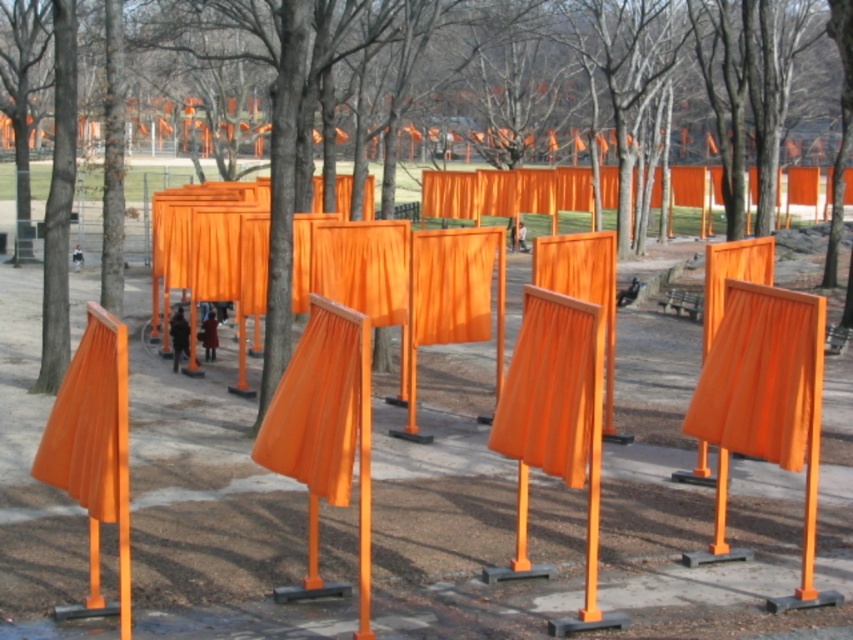
Question: Which point is closer to the camera?

Choices:
 (A) matte orange curtain at left
 (B) matte orange curtain at center
 (C) orange matte fabric at center

Answer: (A)

Question: Which object is the closest to the matte orange curtain at center?

Choices:
 (A) matte wood curtain at center
 (B) orange matte fabric at center
 (C) orange matte curtain at center
 (D) matte orange curtain at left

Answer: (C)

Question: Among these objects, which one is nearest to the camera?

Choices:
 (A) orange matte curtain at center
 (B) matte orange curtain at left

Answer: (B)

Question: Is matte orange curtain at center below orange matte fabric at center?

Choices:
 (A) yes
 (B) no

Answer: (B)

Question: Can you confirm if orange matte fabric at center is wider than matte wood curtain at center?

Choices:
 (A) yes
 (B) no

Answer: (B)

Question: Does orange matte curtain at center appear over matte wood curtain at center?

Choices:
 (A) yes
 (B) no

Answer: (B)